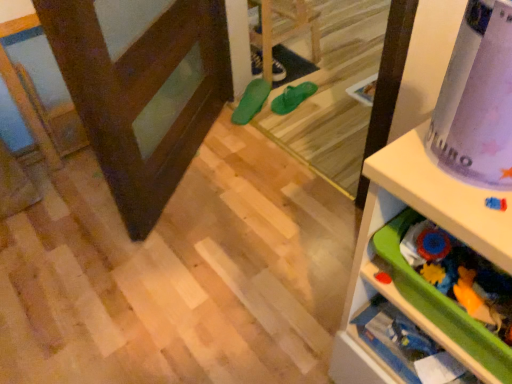
The image size is (512, 384). In order to click on spots to the right of green rubber flip-flops at center, the 2th footwear positioned from the back in this screenshot , I will do `click(325, 96)`.